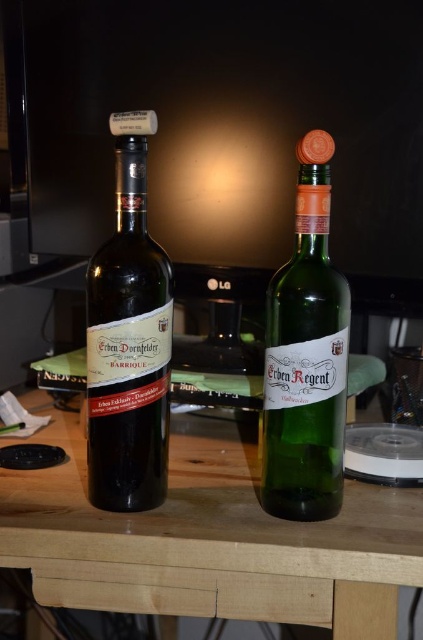
Question: Does matte black bottle at left appear on the right side of green glass bottle at center?

Choices:
 (A) yes
 (B) no

Answer: (B)

Question: Which point is farther to the camera?

Choices:
 (A) (403, 525)
 (B) (316, 160)
 (C) (142, 236)

Answer: (C)

Question: Among these objects, which one is farthest from the camera?

Choices:
 (A) green glass bottle at center
 (B) wooden table at center

Answer: (A)

Question: Does matte black bottle at left appear on the left side of green glass bottle at center?

Choices:
 (A) no
 (B) yes

Answer: (B)

Question: Which object is the farthest from the wooden table at center?

Choices:
 (A) matte black bottle at left
 (B) green glass bottle at center

Answer: (B)

Question: Can you confirm if matte black bottle at left is positioned to the right of green glass bottle at center?

Choices:
 (A) no
 (B) yes

Answer: (A)